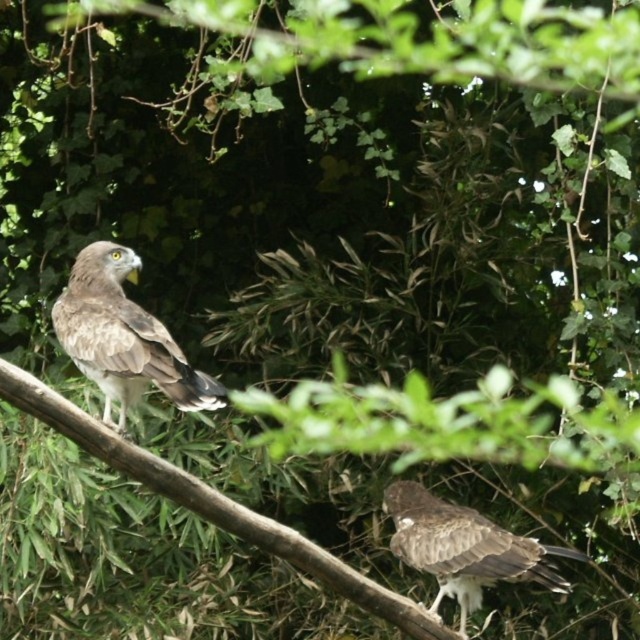
Does brown wood at left have a greater height compared to brown feathered bird at center?

Yes.

Between brown wood at left and brown feathered bird at center, which one has less height?

brown feathered bird at center is shorter.

Who is more forward, [179,477] or [541,564]?

Point [179,477]

Locate an element on the screen. This screenshot has height=640, width=640. brown wood at left is located at coordinates (212, 502).

Consider the image. Between brown feathered eagle at upper left and brown feathered bird at center, which one is positioned lower?

Positioned lower is brown feathered bird at center.

Find the location of a particular element. Image resolution: width=640 pixels, height=640 pixels. brown feathered eagle at upper left is located at coordinates [x=124, y=337].

You are a GUI agent. You are given a task and a screenshot of the screen. Output one action in this format:
    pyautogui.click(x=<x>, y=<y>)
    Task: Click on the brown feathered eagle at upper left
    Image resolution: width=640 pixels, height=640 pixels.
    Given the screenshot: What is the action you would take?
    tap(124, 337)

Consider the image. Is brown wood at left shorter than brown feathered eagle at upper left?

Incorrect, brown wood at left's height does not fall short of brown feathered eagle at upper left's.

From the picture: Is brown wood at left to the left of brown feathered eagle at upper left from the viewer's perspective?

In fact, brown wood at left is to the right of brown feathered eagle at upper left.

Is point (438, 637) behind point (138, 365)?

Yes, it is behind point (138, 365).

Where is `brown wood at left`? The height and width of the screenshot is (640, 640). brown wood at left is located at coordinates (212, 502).